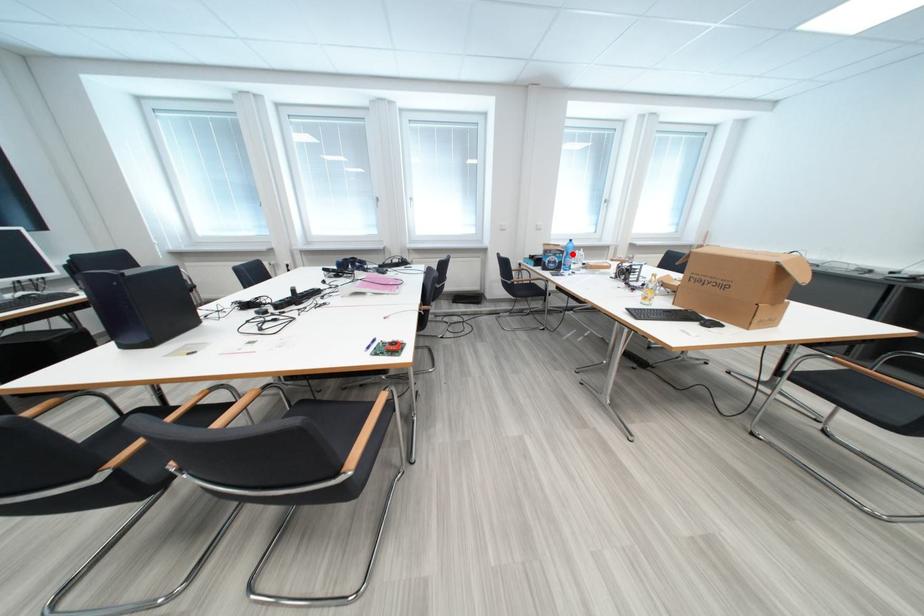
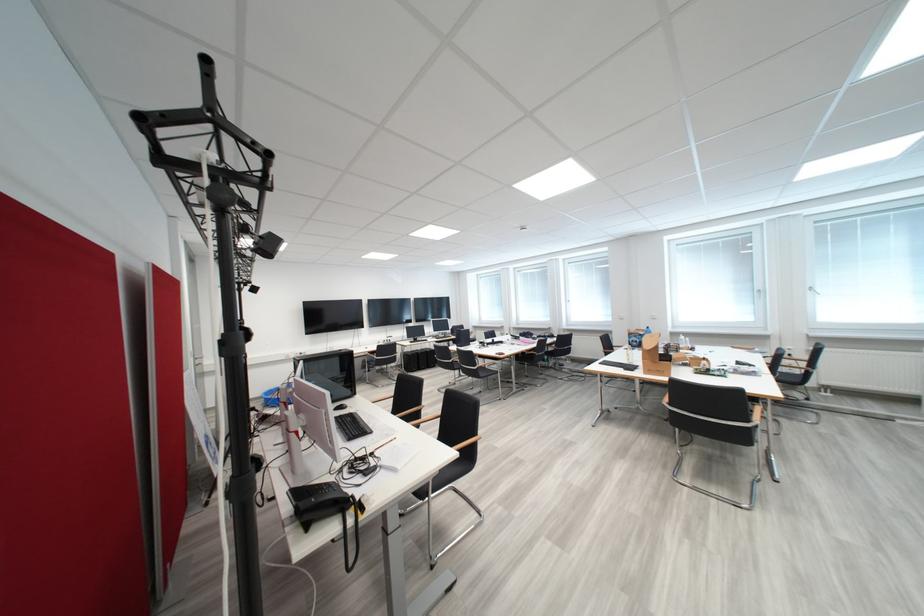
Where in the second image is the point corresponding to the highlighted location from the first image?

(650, 337)